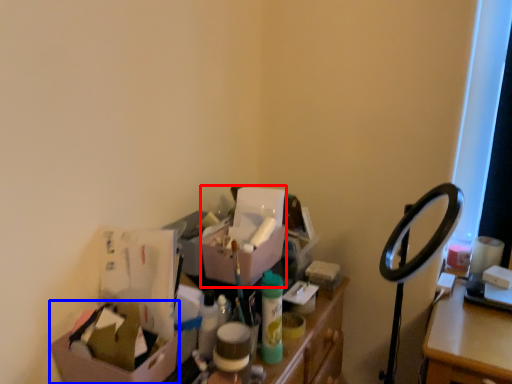
Question: Which point is closer to the camera, box (highlighted by a red box) or box (highlighted by a blue box)?

Choices:
 (A) box
 (B) box

Answer: (B)